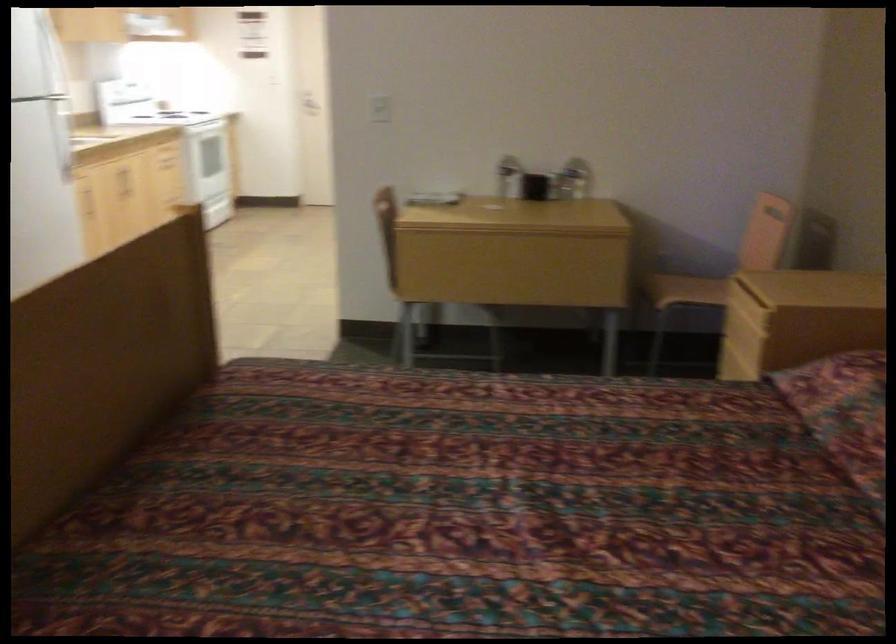
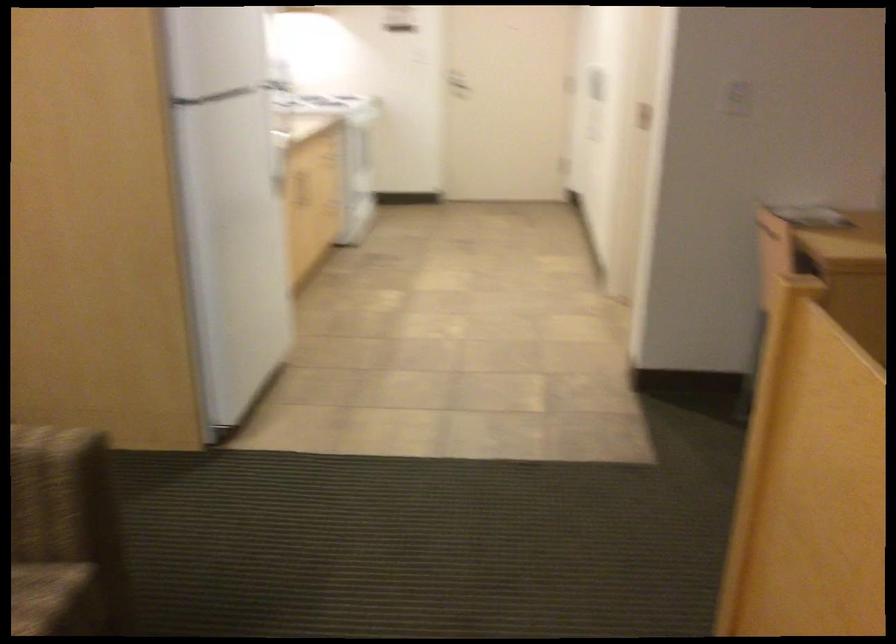
Which direction would the cameraman need to move to produce the second image?

The cameraman walked toward left, forward.